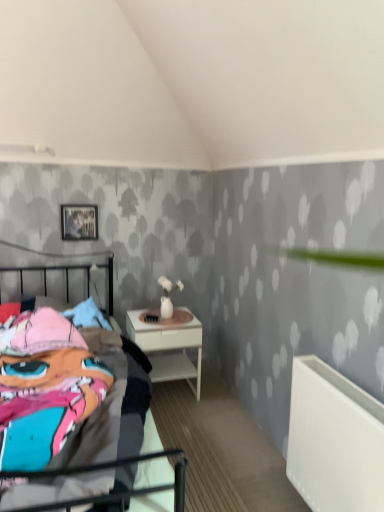
Question: Is metallic silver picture frame at upper left bigger or smaller than multicolored fabric bed at left?

Choices:
 (A) big
 (B) small

Answer: (B)

Question: Is metallic silver picture frame at upper left taller or shorter than multicolored fabric bed at left?

Choices:
 (A) short
 (B) tall

Answer: (A)

Question: Which of these objects is positioned closest to the white plastic radiator at lower right?

Choices:
 (A) metallic silver picture frame at upper left
 (B) white glossy nightstand at center
 (C) multicolored fabric bed at left

Answer: (C)

Question: Considering the real-world distances, which object is closest to the metallic silver picture frame at upper left?

Choices:
 (A) multicolored fabric bed at left
 (B) white plastic radiator at lower right
 (C) white glossy nightstand at center

Answer: (C)